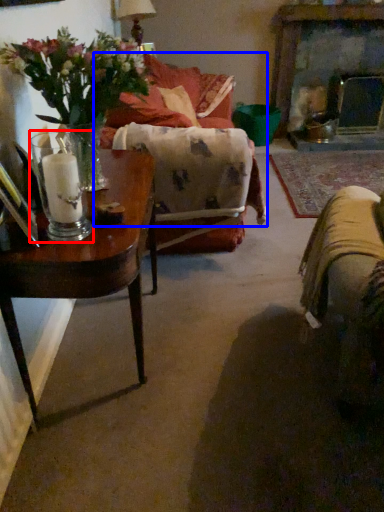
Question: Which point is closer to the camera, candle holder (highlighted by a red box) or couch (highlighted by a blue box)?

Choices:
 (A) candle holder
 (B) couch

Answer: (A)